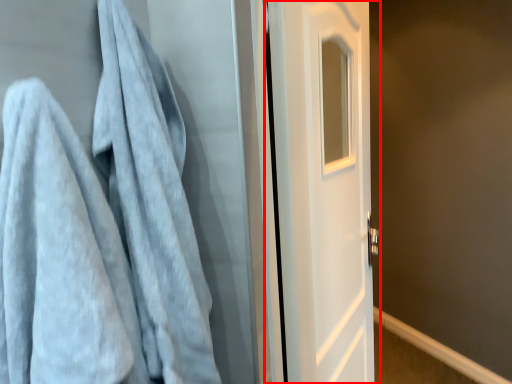
Question: From the image, what is the correct spatial relationship of door (annotated by the red box) in relation to towel?

Choices:
 (A) right
 (B) left

Answer: (A)